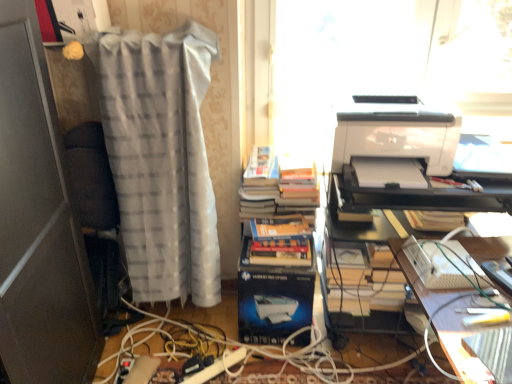
Where is `free point behind metallic silver remote control at lower right, which ranks as the second equipment in left-to-right order`? free point behind metallic silver remote control at lower right, which ranks as the second equipment in left-to-right order is located at coordinates [485, 250].